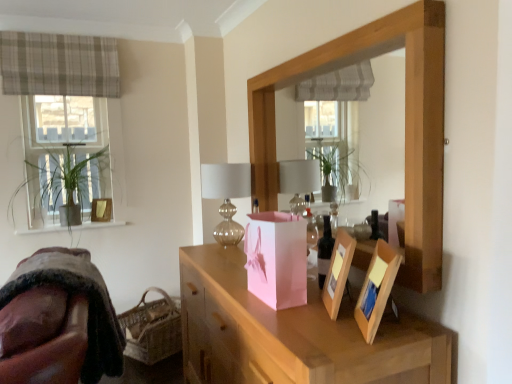
Where is `free space in front of matte gold picture frame at upper left`? The width and height of the screenshot is (512, 384). free space in front of matte gold picture frame at upper left is located at coordinates (88, 229).